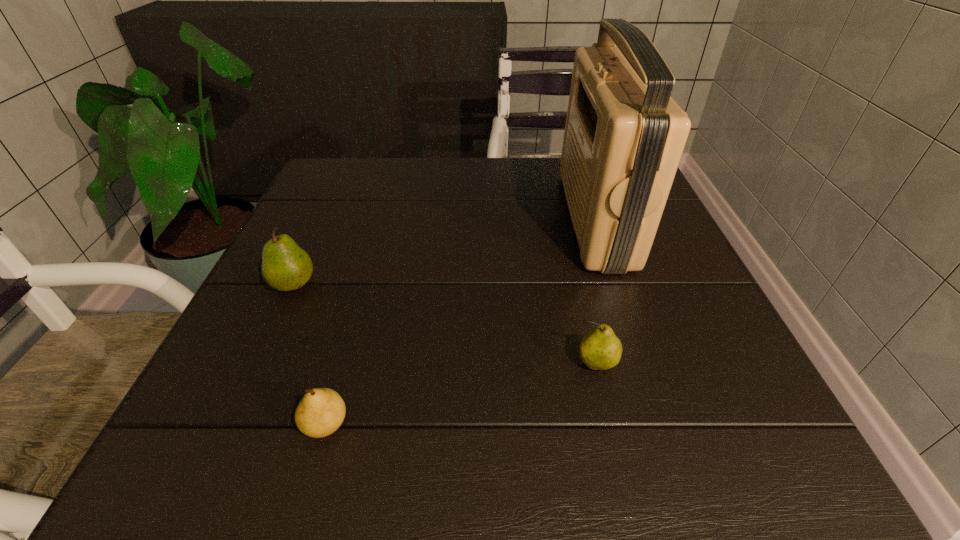
I want to click on vacant space located on the back of the leftmost object, so click(x=311, y=247).

At what (x,y) coordinates should I click in order to perform the action: click on vacant space located on the right of the nearest pear. Please return your answer as a coordinate pair (x, y). The width and height of the screenshot is (960, 540). Looking at the image, I should click on (538, 424).

Where is `vacant space located 0.390m on the back of the second nearest object`? The image size is (960, 540). vacant space located 0.390m on the back of the second nearest object is located at coordinates (560, 213).

At what (x,y) coordinates should I click in order to perform the action: click on object at the far edge. Please return your answer as a coordinate pair (x, y). Looking at the image, I should click on (624, 136).

Find the location of a particular element. object at the near edge is located at coordinates pos(321,411).

Find the location of `object at the left edge`. object at the left edge is located at coordinates (285, 266).

The width and height of the screenshot is (960, 540). I want to click on object positioned at the right edge, so click(x=624, y=136).

The height and width of the screenshot is (540, 960). In order to click on object located at the far right corner in this screenshot , I will do `click(624, 136)`.

The image size is (960, 540). Identify the location of blank space at the far edge of the desktop. (544, 203).

This screenshot has width=960, height=540. In order to click on vacant space at the near edge of the desktop in this screenshot , I will do `click(348, 444)`.